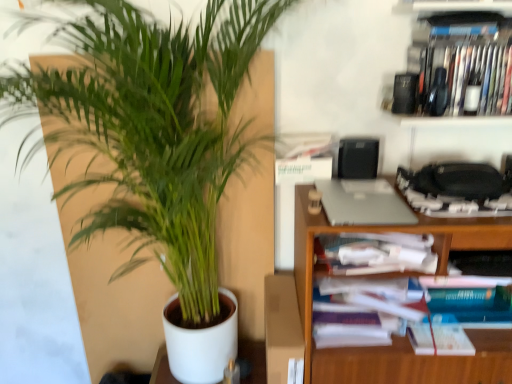
Question: Is white paper book at center right in front of silver metallic laptop at upper right?

Choices:
 (A) yes
 (B) no

Answer: (B)

Question: Does white paper book at center right have a greater height compared to silver metallic laptop at upper right?

Choices:
 (A) no
 (B) yes

Answer: (B)

Question: From a real-world perspective, is white paper book at center right beneath silver metallic laptop at upper right?

Choices:
 (A) no
 (B) yes

Answer: (B)

Question: Does white paper book at center right have a greater width compared to silver metallic laptop at upper right?

Choices:
 (A) yes
 (B) no

Answer: (A)

Question: Can you confirm if white paper book at center right is positioned to the right of silver metallic laptop at upper right?

Choices:
 (A) yes
 (B) no

Answer: (A)

Question: Considering the positions of green leafy plant at left and metallic silver cabinet at upper right in the image, is green leafy plant at left wider or thinner than metallic silver cabinet at upper right?

Choices:
 (A) thin
 (B) wide

Answer: (A)

Question: In the image, is green leafy plant at left positioned in front of or behind metallic silver cabinet at upper right?

Choices:
 (A) front
 (B) behind

Answer: (B)

Question: Considering the positions of green leafy plant at left and metallic silver cabinet at upper right in the image, is green leafy plant at left bigger or smaller than metallic silver cabinet at upper right?

Choices:
 (A) small
 (B) big

Answer: (B)

Question: From a real-world perspective, relative to metallic silver cabinet at upper right, is green leafy plant at left vertically above or below?

Choices:
 (A) below
 (B) above

Answer: (A)

Question: Is metallic silver cabinet at upper right inside the boundaries of silver metallic laptop at upper right, or outside?

Choices:
 (A) outside
 (B) inside

Answer: (A)

Question: Looking at their shapes, would you say metallic silver cabinet at upper right is wider or thinner than silver metallic laptop at upper right?

Choices:
 (A) thin
 (B) wide

Answer: (A)

Question: Is metallic silver cabinet at upper right in front of or behind silver metallic laptop at upper right in the image?

Choices:
 (A) behind
 (B) front

Answer: (A)

Question: Does point (499, 18) appear closer or farther from the camera than point (357, 192)?

Choices:
 (A) closer
 (B) farther

Answer: (A)

Question: Is point (372, 211) positioned closer to the camera than point (450, 26)?

Choices:
 (A) farther
 (B) closer

Answer: (B)

Question: Is silver metallic laptop at upper right bigger or smaller than metallic silver cabinet at upper right?

Choices:
 (A) big
 (B) small

Answer: (B)